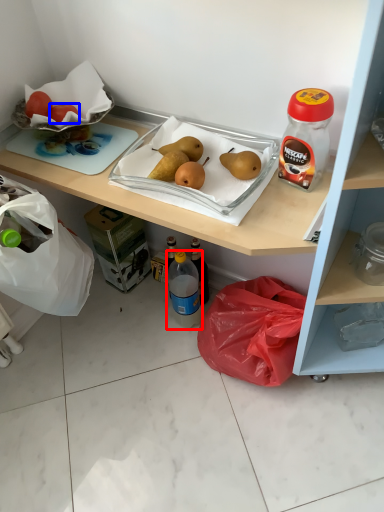
Question: Which object is closer to the camera taking this photo, bottle (highlighted by a red box) or fruit (highlighted by a blue box)?

Choices:
 (A) bottle
 (B) fruit

Answer: (B)